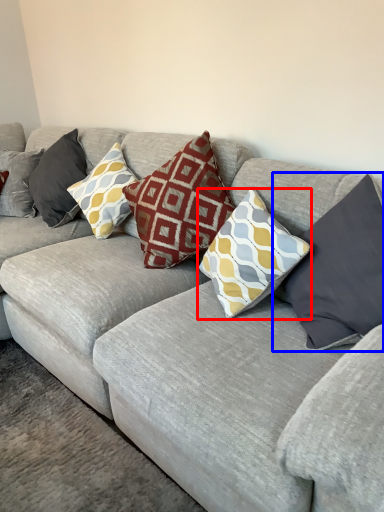
Question: Which of the following is the closest to the observer, pillow (highlighted by a red box) or pillow (highlighted by a blue box)?

Choices:
 (A) pillow
 (B) pillow

Answer: (B)